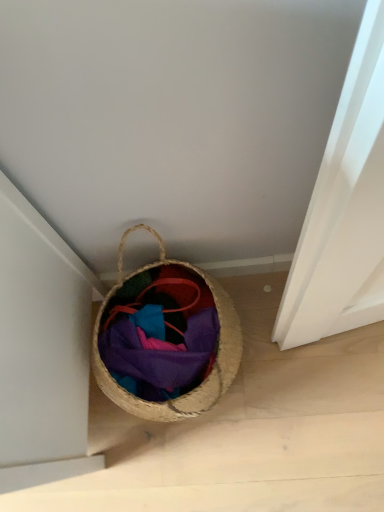
At what (x,y) coordinates should I click in order to perform the action: click on vacant area that lies to the right of braided straw basket at lower center. Please return your answer as a coordinate pair (x, y). Looking at the image, I should click on (295, 356).